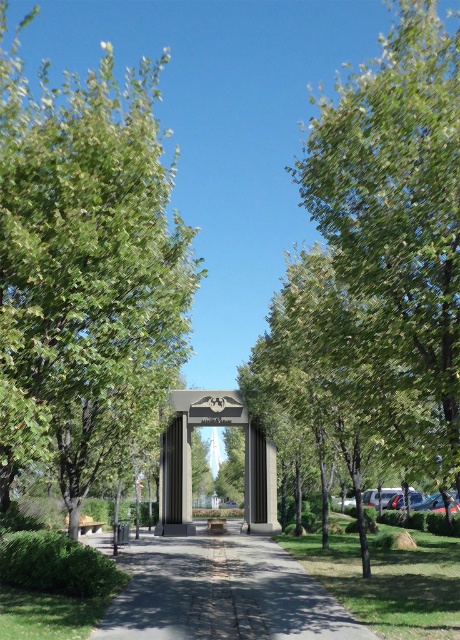
Between point (425, 228) and point (59, 148), which one is positioned in front?

Point (425, 228) is more forward.

Between green leafy tree at center and green leafy tree at left, which one is positioned higher?

Positioned higher is green leafy tree at left.

What do you see at coordinates (377, 266) in the screenshot?
I see `green leafy tree at center` at bounding box center [377, 266].

The height and width of the screenshot is (640, 460). I want to click on green leafy tree at center, so click(x=377, y=266).

Does green leafy tree at center lie behind gray concrete pavement at center?

No, green leafy tree at center is closer to the viewer.

Is green leafy tree at center taller than gray concrete pavement at center?

Yes.

Between point (341, 444) and point (160, 627), which one is positioned behind?

Positioned behind is point (341, 444).

At what (x,y) coordinates should I click in order to perform the action: click on green leafy tree at center. Please return your answer as a coordinate pair (x, y). The height and width of the screenshot is (640, 460). Looking at the image, I should click on (377, 266).

Is green leafy tree at left in front of gray concrete pavement at center?

Yes.

This screenshot has height=640, width=460. Describe the element at coordinates (85, 257) in the screenshot. I see `green leafy tree at left` at that location.

The height and width of the screenshot is (640, 460). I want to click on green leafy tree at left, so click(x=85, y=257).